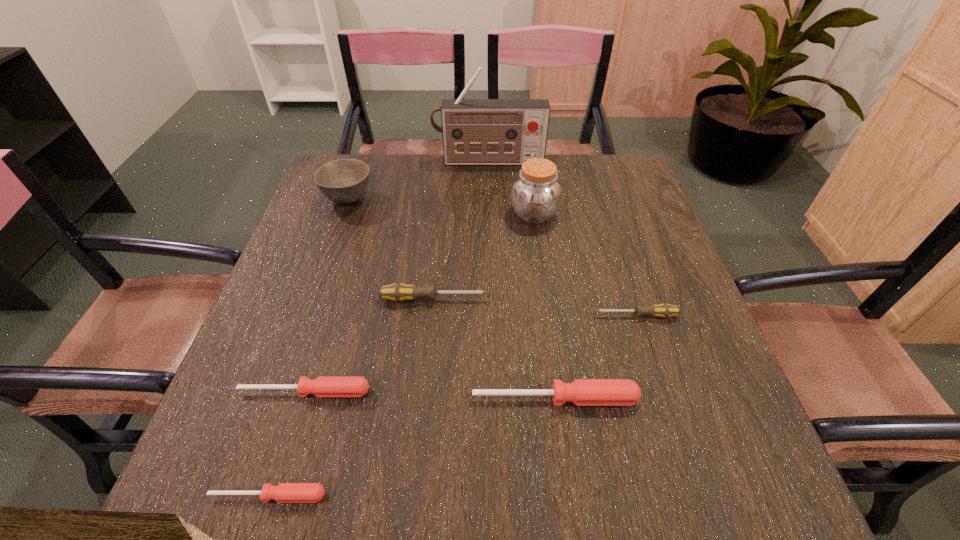
Where is `the farthest object`? Image resolution: width=960 pixels, height=540 pixels. the farthest object is located at coordinates (475, 131).

You are a GUI agent. You are given a task and a screenshot of the screen. Output one action in this format:
    pyautogui.click(x=<x>, y=<y>)
    Task: Click on the radio receiver
    
    Given the screenshot: What is the action you would take?
    pyautogui.click(x=475, y=131)

Locate an element on the screen. The height and width of the screenshot is (540, 960). the seventh shortest object is located at coordinates (536, 194).

This screenshot has height=540, width=960. In order to click on jar in this screenshot , I will do `click(536, 194)`.

I want to click on bowl, so click(344, 181).

Image resolution: width=960 pixels, height=540 pixels. I want to click on the farther gray screwdriver, so click(x=398, y=292).

Where is `the farthest screwdriver`? The image size is (960, 540). the farthest screwdriver is located at coordinates (398, 292).

Image resolution: width=960 pixels, height=540 pixels. In order to click on the biggest red screwdriver in this screenshot , I will do (x=582, y=392).

This screenshot has width=960, height=540. I want to click on the second biggest red screwdriver, so click(x=323, y=386).

The image size is (960, 540). In order to click on the fourth nearest screwdriver in this screenshot , I will do `click(663, 310)`.